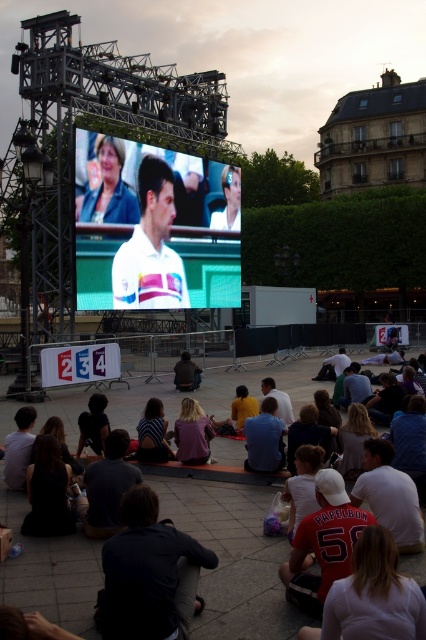
Describe the element at coordinates (152, 228) in the screenshot. This screenshot has height=640, width=426. I see `white glossy tennis player at center` at that location.

Can you confirm if white glossy tennis player at center is taller than matte blue jacket at upper left?

Yes, white glossy tennis player at center is taller than matte blue jacket at upper left.

Identify the location of white glossy tennis player at center. Image resolution: width=426 pixels, height=640 pixels. (152, 228).

Does red jersey at lower center appear over dark gray t-shirt at center?

Indeed, red jersey at lower center is positioned over dark gray t-shirt at center.

Does red jersey at lower center have a greater width compared to dark gray t-shirt at center?

Indeed, red jersey at lower center has a greater width compared to dark gray t-shirt at center.

Is point (290, 579) closer to viewer compared to point (120, 456)?

That is True.

Image resolution: width=426 pixels, height=640 pixels. I want to click on red jersey at lower center, so click(322, 544).

Can you confirm if matte black crowd at center is bigger than blonde hair at center?

Indeed, matte black crowd at center has a larger size compared to blonde hair at center.

Between point (175, 481) and point (184, 417), which one is positioned in front?

Point (175, 481) is in front.

I want to click on matte black crowd at center, so click(232, 554).